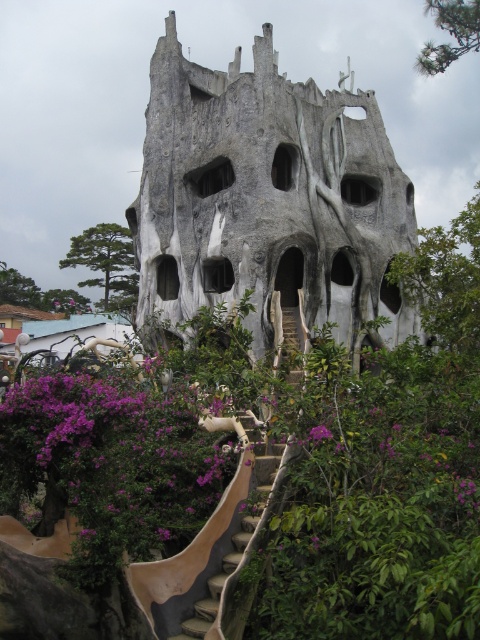
You are standing at the base of the steps leading to the entrance of the surreal building. You notice two trees at the upper left corner of the scene. Which tree is closer to you, the green leafy tree at upper left or the purple leafy tree at upper left?

The green leafy tree at upper left is closer to you because it is in front of the purple leafy tree at upper left.

You are standing at the entrance of the surreal building and want to take a photo of the purple leafy tree at upper left. In which direction should you point your camera to capture it in the frame?

The purple leafy tree at upper left is located at point (37,292), so you should point your camera towards the upper left direction to capture it in the frame.